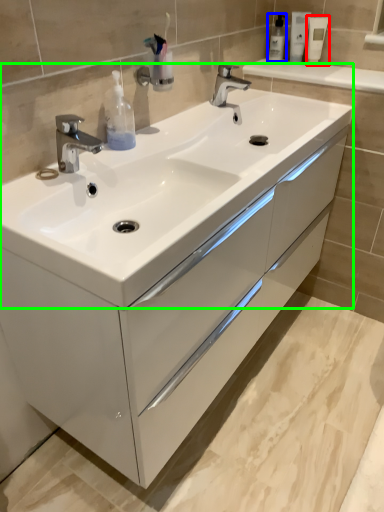
Question: Which is nearer to the mouthwash (highlighted by a red box)? mouthwash (highlighted by a blue box) or sink (highlighted by a green box).

Choices:
 (A) mouthwash
 (B) sink

Answer: (A)